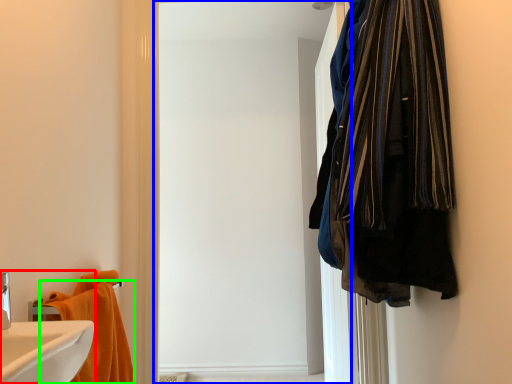
Question: Which object is positioned closest to bathroom cabinet (highlighted by a red box)? Select from screen door (highlighted by a blue box) and towel (highlighted by a green box).

Choices:
 (A) screen door
 (B) towel

Answer: (B)